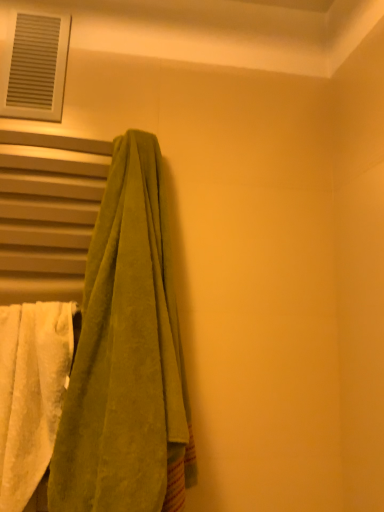
Question: Does green velvety towel at left, the 1th towel in the right-to-left sequence, have a lesser height compared to white plastic vent at upper left?

Choices:
 (A) no
 (B) yes

Answer: (A)

Question: Is white plastic vent at upper left at the back of green velvety towel at left, which is counted as the 2th towel, starting from the left?

Choices:
 (A) no
 (B) yes

Answer: (A)

Question: From the image's perspective, is green velvety towel at left, the 1th towel in the right-to-left sequence, on white plastic vent at upper left?

Choices:
 (A) yes
 (B) no

Answer: (B)

Question: Is green velvety towel at left, the 1th towel in the right-to-left sequence, in contact with white plastic vent at upper left?

Choices:
 (A) no
 (B) yes

Answer: (A)

Question: Does green velvety towel at left, the 1th towel in the right-to-left sequence, have a greater width compared to white plastic vent at upper left?

Choices:
 (A) yes
 (B) no

Answer: (A)

Question: Is white fluffy towel at left, placed as the 1th towel when sorted from left to right, at the left side of white plastic vent at upper left?

Choices:
 (A) yes
 (B) no

Answer: (B)

Question: From the image's perspective, is white fluffy towel at left, placed as the 1th towel when sorted from left to right, on white plastic vent at upper left?

Choices:
 (A) no
 (B) yes

Answer: (A)

Question: Is white fluffy towel at left, placed as the 1th towel when sorted from left to right, thinner than white plastic vent at upper left?

Choices:
 (A) yes
 (B) no

Answer: (B)

Question: Is there a large distance between white fluffy towel at left, which is the second towel from right to left, and white plastic vent at upper left?

Choices:
 (A) yes
 (B) no

Answer: (B)

Question: Does white fluffy towel at left, which is the second towel from right to left, appear on the right side of white plastic vent at upper left?

Choices:
 (A) yes
 (B) no

Answer: (A)

Question: Is white fluffy towel at left, placed as the 1th towel when sorted from left to right, beside white plastic vent at upper left?

Choices:
 (A) yes
 (B) no

Answer: (B)

Question: Considering the relative positions of white fluffy towel at left, which is the second towel from right to left, and green velvety towel at left, the 1th towel in the right-to-left sequence, in the image provided, is white fluffy towel at left, which is the second towel from right to left, in front of green velvety towel at left, the 1th towel in the right-to-left sequence,?

Choices:
 (A) no
 (B) yes

Answer: (A)